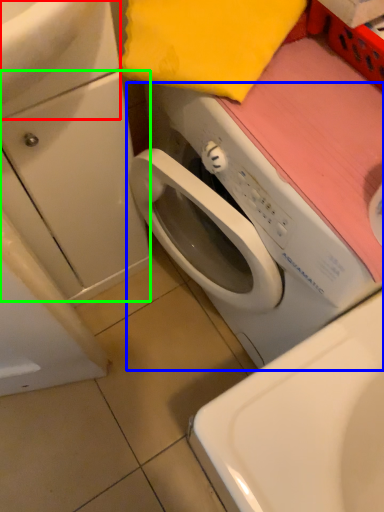
Question: Which is nearer to the sink (highlighted by a red box)? washing machine (highlighted by a blue box) or drawer (highlighted by a green box).

Choices:
 (A) washing machine
 (B) drawer

Answer: (B)